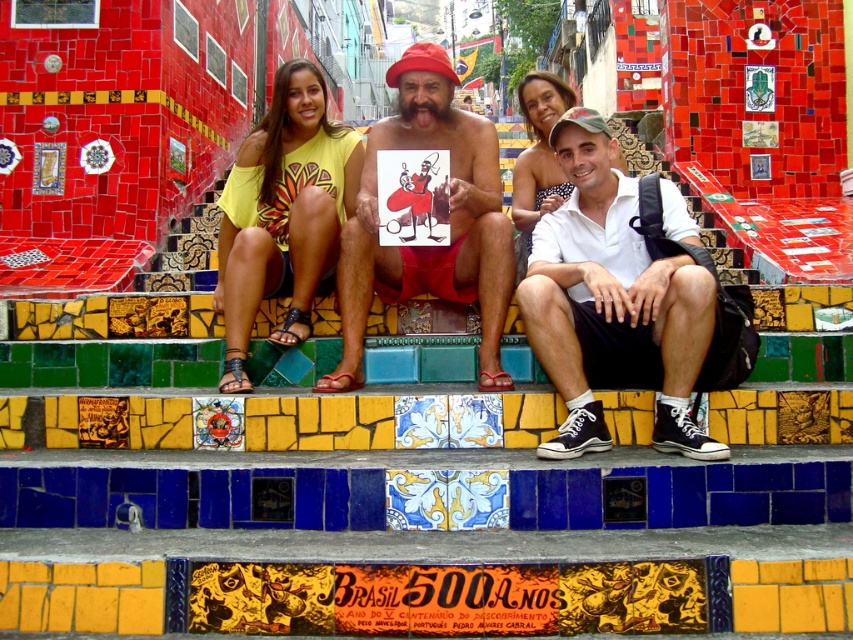
Question: Among these points, which one is farthest from the camera?

Choices:
 (A) (219, 278)
 (B) (572, 428)

Answer: (A)

Question: Is white cotton shirt at center to the right of yellow cotton shirt at center from the viewer's perspective?

Choices:
 (A) yes
 (B) no

Answer: (A)

Question: Can you confirm if white cotton shirt at center is bigger than matte red shorts at center?

Choices:
 (A) yes
 (B) no

Answer: (A)

Question: Does white cotton shirt at center appear over matte red shorts at center?

Choices:
 (A) yes
 (B) no

Answer: (B)

Question: Estimate the real-world distances between objects in this image. Which object is farther from the matte red shorts at center?

Choices:
 (A) yellow cotton shirt at center
 (B) white cotton shirt at center

Answer: (B)

Question: Which of the following is the farthest from the observer?

Choices:
 (A) yellow cotton shirt at center
 (B) matte red shorts at center

Answer: (B)